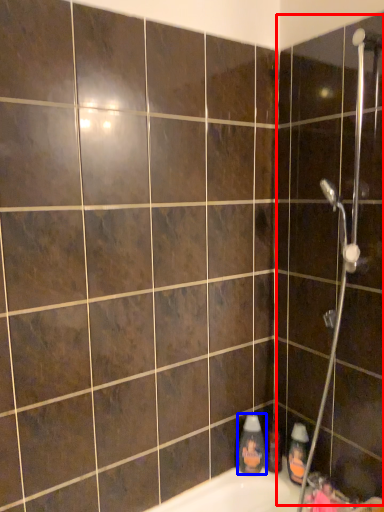
Question: Which object appears closest to the camera in this image, screen door (highlighted by a red box) or cleaning product (highlighted by a blue box)?

Choices:
 (A) screen door
 (B) cleaning product

Answer: (A)